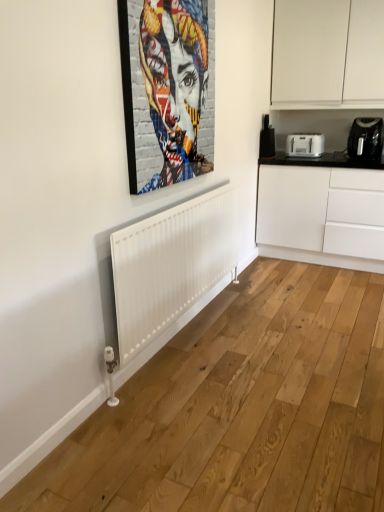
Question: Is white plastic toaster at upper right smaller than metallic silver picture frame at upper center?

Choices:
 (A) no
 (B) yes

Answer: (B)

Question: Does white plastic toaster at upper right have a greater width compared to metallic silver picture frame at upper center?

Choices:
 (A) no
 (B) yes

Answer: (B)

Question: Is white plastic toaster at upper right positioned beyond the bounds of metallic silver picture frame at upper center?

Choices:
 (A) yes
 (B) no

Answer: (A)

Question: Is white plastic toaster at upper right shorter than metallic silver picture frame at upper center?

Choices:
 (A) yes
 (B) no

Answer: (A)

Question: Is the position of white plastic toaster at upper right more distant than that of metallic silver picture frame at upper center?

Choices:
 (A) no
 (B) yes

Answer: (B)

Question: Is white plastic toaster at upper right beside metallic silver picture frame at upper center?

Choices:
 (A) no
 (B) yes

Answer: (A)

Question: Considering the relative sizes of white matte cabinet at upper right, placed as the second cabinetry when sorted from bottom to top, and black plastic toaster at upper right, the second appliance when ordered from right to left, in the image provided, is white matte cabinet at upper right, placed as the second cabinetry when sorted from bottom to top, bigger than black plastic toaster at upper right, the second appliance when ordered from right to left,?

Choices:
 (A) yes
 (B) no

Answer: (A)

Question: Does white matte cabinet at upper right, the 1th cabinetry from the top, have a lesser height compared to black plastic toaster at upper right, the 1th appliance when ordered from left to right?

Choices:
 (A) no
 (B) yes

Answer: (A)

Question: Can you confirm if white matte cabinet at upper right, placed as the second cabinetry when sorted from bottom to top, is positioned to the left of black plastic toaster at upper right, the second appliance when ordered from right to left?

Choices:
 (A) yes
 (B) no

Answer: (B)

Question: Is white matte cabinet at upper right, placed as the second cabinetry when sorted from bottom to top, facing towards black plastic toaster at upper right, the second appliance when ordered from right to left?

Choices:
 (A) yes
 (B) no

Answer: (B)

Question: Is white matte cabinet at upper right, placed as the second cabinetry when sorted from bottom to top, directly adjacent to black plastic toaster at upper right, the 1th appliance when ordered from left to right?

Choices:
 (A) no
 (B) yes

Answer: (A)

Question: Is white matte cabinet at upper right, the 1th cabinetry from the top, not within black plastic toaster at upper right, the 1th appliance when ordered from left to right?

Choices:
 (A) no
 (B) yes

Answer: (B)

Question: Does metallic silver picture frame at upper center have a smaller size compared to white matte cabinet at right, marked as the second cabinetry in a top-to-bottom arrangement?

Choices:
 (A) no
 (B) yes

Answer: (B)